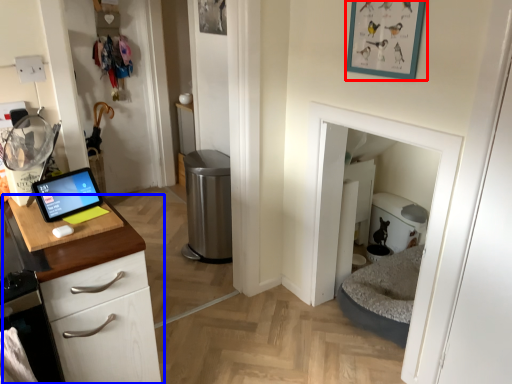
Question: Which object appears closest to the camera in this image, picture frame (highlighted by a red box) or cabinetry (highlighted by a blue box)?

Choices:
 (A) picture frame
 (B) cabinetry

Answer: (B)